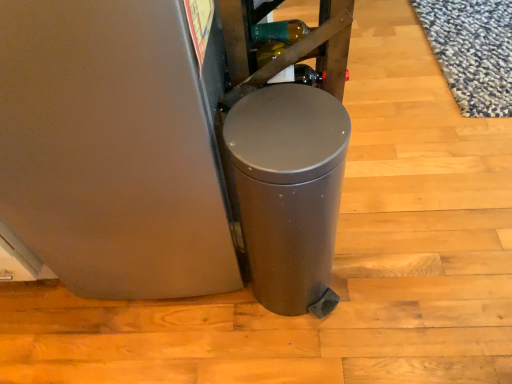
Measure the distance between satin metallic trash can at center and camera.

They are 29.58 inches apart.

What do you see at coordinates (288, 191) in the screenshot? The image size is (512, 384). I see `satin metallic trash can at center` at bounding box center [288, 191].

Measure the distance between point (x=308, y=247) and camera.

Point (x=308, y=247) and camera are 37.91 inches apart from each other.

You are a GUI agent. You are given a task and a screenshot of the screen. Output one action in this format:
    pyautogui.click(x=<x>, y=<y>)
    Task: Click on the satin metallic trash can at center
    The width and height of the screenshot is (512, 384).
    Given the screenshot: What is the action you would take?
    pyautogui.click(x=288, y=191)

Looking at this image, in order to face metallic brown shelf at upper center, should I rotate leftwards or rightwards?

Turn right approximately 4.048 degrees to face it.

The width and height of the screenshot is (512, 384). Find the location of `metallic brown shelf at upper center`. metallic brown shelf at upper center is located at coordinates [x=289, y=57].

What do you see at coordinates (289, 57) in the screenshot? The height and width of the screenshot is (384, 512). I see `metallic brown shelf at upper center` at bounding box center [289, 57].

You are a GUI agent. You are given a task and a screenshot of the screen. Output one action in this format:
    pyautogui.click(x=<x>, y=<y>)
    Task: Click on the satin metallic trash can at center
    
    Given the screenshot: What is the action you would take?
    288,191

Between satin metallic trash can at center and metallic brown shelf at upper center, which one appears on the left side from the viewer's perspective?

Positioned to the left is metallic brown shelf at upper center.

Which object is further away from the camera, satin metallic trash can at center or metallic brown shelf at upper center?

metallic brown shelf at upper center is behind.

Is point (328, 143) closer to camera compared to point (308, 43)?

Yes.

From the image's perspective, is satin metallic trash can at center over metallic brown shelf at upper center?

No, from the image's perspective, satin metallic trash can at center is not over metallic brown shelf at upper center.

From a real-world perspective, which is physically below, satin metallic trash can at center or metallic brown shelf at upper center?

satin metallic trash can at center is physically lower.

Between satin metallic trash can at center and metallic brown shelf at upper center, which one has smaller width?

satin metallic trash can at center is thinner.

From the picture: Is satin metallic trash can at center taller or shorter than metallic brown shelf at upper center?

Clearly, satin metallic trash can at center is taller compared to metallic brown shelf at upper center.

Considering the sizes of objects satin metallic trash can at center and metallic brown shelf at upper center in the image provided, who is smaller, satin metallic trash can at center or metallic brown shelf at upper center?

Smaller between the two is metallic brown shelf at upper center.

Could metallic brown shelf at upper center be considered to be inside satin metallic trash can at center?

Actually, metallic brown shelf at upper center is outside satin metallic trash can at center.

Is there a large distance between satin metallic trash can at center and metallic brown shelf at upper center?

No, satin metallic trash can at center is not far from metallic brown shelf at upper center.

Is satin metallic trash can at center oriented towards metallic brown shelf at upper center?

No, satin metallic trash can at center is not aimed at metallic brown shelf at upper center.

How many degrees apart are the facing directions of satin metallic trash can at center and metallic brown shelf at upper center?

The angular difference between satin metallic trash can at center and metallic brown shelf at upper center is 0.000376 degrees.

How far apart are satin metallic trash can at center and metallic brown shelf at upper center?

satin metallic trash can at center is 26.96 centimeters away from metallic brown shelf at upper center.

At what (x,y) coordinates should I click in order to perform the action: click on waste container directly beneath the metallic brown shelf at upper center (from a real-world perspective). Please return your answer as a coordinate pair (x, y). Looking at the image, I should click on (288, 191).

Based on their positions, is metallic brown shelf at upper center located to the left or right of satin metallic trash can at center?

In the image, metallic brown shelf at upper center appears on the left side of satin metallic trash can at center.

Between metallic brown shelf at upper center and satin metallic trash can at center, which one is positioned behind?

metallic brown shelf at upper center is further away from the camera.

Does point (295, 57) lie behind point (241, 104)?

Yes, it is.

From the image's perspective, does metallic brown shelf at upper center appear lower than satin metallic trash can at center?

Incorrect, from the image's perspective, metallic brown shelf at upper center is higher than satin metallic trash can at center.

From a real-world perspective, which is physically above, metallic brown shelf at upper center or satin metallic trash can at center?

metallic brown shelf at upper center is physically above.

Can you confirm if metallic brown shelf at upper center is thinner than satin metallic trash can at center?

No, metallic brown shelf at upper center is not thinner than satin metallic trash can at center.

Which of these two, metallic brown shelf at upper center or satin metallic trash can at center, stands taller?

Standing taller between the two is satin metallic trash can at center.

Considering the sizes of metallic brown shelf at upper center and satin metallic trash can at center in the image, is metallic brown shelf at upper center bigger or smaller than satin metallic trash can at center?

In the image, metallic brown shelf at upper center appears to be smaller than satin metallic trash can at center.

Is metallic brown shelf at upper center located outside satin metallic trash can at center?

Yes, metallic brown shelf at upper center is not within satin metallic trash can at center.

From the picture: Is metallic brown shelf at upper center next to satin metallic trash can at center?

No, metallic brown shelf at upper center is not making contact with satin metallic trash can at center.

Is satin metallic trash can at center at the back of metallic brown shelf at upper center?

No, metallic brown shelf at upper center's orientation is not away from satin metallic trash can at center.

How different are the orientations of metallic brown shelf at upper center and satin metallic trash can at center in degrees?

There is a 0.000376-degree angle between the facing directions of metallic brown shelf at upper center and satin metallic trash can at center.

There is a satin metallic trash can at center. At what (x,y) coordinates should I click in order to perform the action: click on shelf above it (from a real-world perspective). Please return your answer as a coordinate pair (x, y). Looking at the image, I should click on (289, 57).

I want to click on shelf above the satin metallic trash can at center (from the image's perspective), so click(x=289, y=57).

The image size is (512, 384). Identify the location of waste container on the right of metallic brown shelf at upper center. (288, 191).